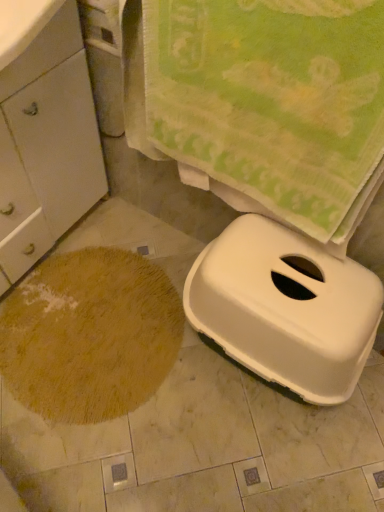
Image resolution: width=384 pixels, height=512 pixels. What are the coordinates of `vacant space underneath brown shaggy rug at lower left (from a real-world perspective)` in the screenshot? It's located at (96, 351).